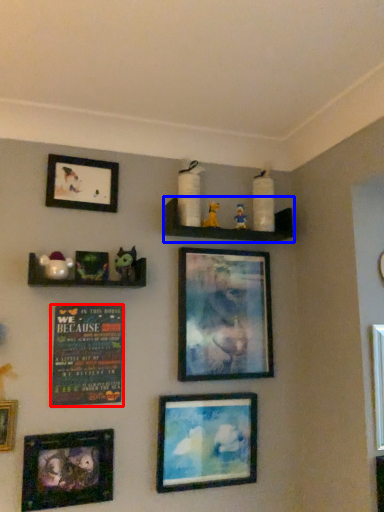
Question: Among these objects, which one is farthest to the camera, plaque (highlighted by a red box) or shelf (highlighted by a blue box)?

Choices:
 (A) plaque
 (B) shelf

Answer: (B)